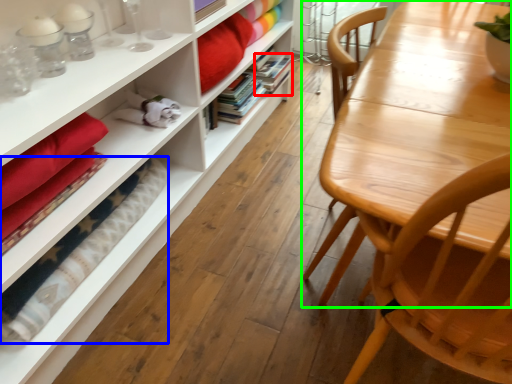
Question: Based on their relative distances, which object is farther from book (highlighted by a red box)? Choose from blanket (highlighted by a blue box) and table (highlighted by a green box).

Choices:
 (A) blanket
 (B) table

Answer: (B)